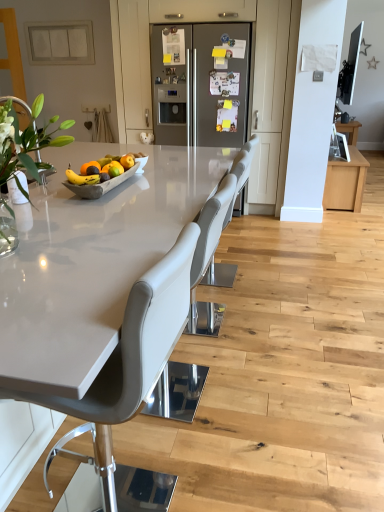
The image size is (384, 512). Describe the element at coordinates (81, 178) in the screenshot. I see `shiny metallic tray at center` at that location.

This screenshot has height=512, width=384. What do you see at coordinates (105, 182) in the screenshot? I see `wooden tray at center` at bounding box center [105, 182].

At what (x,y) coordinates should I click in order to perform the action: click on matte gray chair at center, which is the third chair in back-to-front order. Please return your answer as a coordinate pair (x, y). Looking at the image, I should click on (133, 355).

Is matte gray chair at center, which is the third chair in back-to-front order, spatially inside gray leather chair at center, arranged as the 1th chair when viewed from the back, or outside of it?

The correct answer is: outside.

Between matte gray chair at center, placed as the first chair when sorted from front to back, and gray leather chair at center, arranged as the 1th chair when viewed from the back, which one has larger size?

matte gray chair at center, placed as the first chair when sorted from front to back.

The width and height of the screenshot is (384, 512). I want to click on the 2nd chair behind when counting from the matte gray chair at center, placed as the first chair when sorted from front to back, so 239,177.

From the image's perspective, between matte gray chair at center, which is the third chair in back-to-front order, and gray leather chair at center, arranged as the 1th chair when viewed from the back, who is located below?

matte gray chair at center, which is the third chair in back-to-front order, appears lower in the image.

Where is `appliance on the left of gray leather chair at center, which is the 3th chair in front-to-back order`? This screenshot has width=384, height=512. appliance on the left of gray leather chair at center, which is the 3th chair in front-to-back order is located at coordinates (201, 84).

Does gray leather chair at center, arranged as the 1th chair when viewed from the back, turn towards satin steel refrigerator at center?

No, gray leather chair at center, arranged as the 1th chair when viewed from the back, is not turned towards satin steel refrigerator at center.

Is the depth of gray leather chair at center, arranged as the 1th chair when viewed from the back, less than that of satin steel refrigerator at center?

Yes, gray leather chair at center, arranged as the 1th chair when viewed from the back, is closer to the viewer.

From the image's perspective, is gray leather chair at center, arranged as the 1th chair when viewed from the back, on satin steel refrigerator at center?

No.

Is white glossy countertop at center facing away from satin silver refrigerator at center, which is the first cabinetry from right to left?

That's not correct — white glossy countertop at center is not looking away from satin silver refrigerator at center, which is the first cabinetry from right to left.

Considering the relative positions of white glossy countertop at center and satin silver refrigerator at center, positioned as the second cabinetry in left-to-right order, in the image provided, is white glossy countertop at center to the right of satin silver refrigerator at center, positioned as the second cabinetry in left-to-right order, from the viewer's perspective?

No, white glossy countertop at center is not to the right of satin silver refrigerator at center, positioned as the second cabinetry in left-to-right order.

Considering the sizes of objects white glossy countertop at center and satin silver refrigerator at center, which is the first cabinetry from right to left, in the image provided, who is bigger, white glossy countertop at center or satin silver refrigerator at center, which is the first cabinetry from right to left,?

With larger size is white glossy countertop at center.

From the picture: From a real-world perspective, who is located higher, gray leather chair at center, the 2th chair in the front-to-back sequence, or white matte switch plate at upper left, the first cabinetry in the left-to-right sequence?

From a 3D spatial view, white matte switch plate at upper left, the first cabinetry in the left-to-right sequence, is above.

Who is smaller, gray leather chair at center, the second chair from the back, or white matte switch plate at upper left, the first cabinetry in the left-to-right sequence?

white matte switch plate at upper left, the first cabinetry in the left-to-right sequence, is smaller.

Between gray leather chair at center, the 2th chair in the front-to-back sequence, and white matte switch plate at upper left, which ranks as the 2th cabinetry in right-to-left order, which one appears on the right side from the viewer's perspective?

From the viewer's perspective, gray leather chair at center, the 2th chair in the front-to-back sequence, appears more on the right side.

Is gray leather chair at center, the 2th chair in the front-to-back sequence, not close to white matte switch plate at upper left, which ranks as the 2th cabinetry in right-to-left order?

Absolutely, gray leather chair at center, the 2th chair in the front-to-back sequence, is distant from white matte switch plate at upper left, which ranks as the 2th cabinetry in right-to-left order.

Which is in front, point (167, 371) or point (225, 33)?

Positioned in front is point (167, 371).

Looking at their sizes, would you say gray leather chair at center, the 2th chair in the front-to-back sequence, is wider or thinner than satin steel refrigerator at center?

Clearly, gray leather chair at center, the 2th chair in the front-to-back sequence, has less width compared to satin steel refrigerator at center.

In the scene shown: From a real-world perspective, who is located lower, gray leather chair at center, the second chair from the back, or satin steel refrigerator at center?

In real-world perspective, gray leather chair at center, the second chair from the back, is lower.

Is wooden tray at center oriented away from gray leather chair at center, the second chair from the back?

No, gray leather chair at center, the second chair from the back, is not at the back of wooden tray at center.

Is wooden tray at center next to gray leather chair at center, the 2th chair in the front-to-back sequence?

No, wooden tray at center is not beside gray leather chair at center, the 2th chair in the front-to-back sequence.

Can you confirm if wooden tray at center is bigger than gray leather chair at center, the second chair from the back?

No.

Between wooden tray at center and gray leather chair at center, the 2th chair in the front-to-back sequence, which one has smaller width?

wooden tray at center.

Based on the photo, between wooden tray at center and orangesmoothfruit at center, which one is positioned behind?

orangesmoothfruit at center is behind.

From the image's perspective, is wooden tray at center on top of orangesmoothfruit at center?

No.

Can you tell me how much wooden tray at center and orangesmoothfruit at center differ in facing direction?

The angular difference between wooden tray at center and orangesmoothfruit at center is 1.91 degrees.

How much distance is there between wooden tray at center and orangesmoothfruit at center?

wooden tray at center and orangesmoothfruit at center are 5.09 inches apart from each other.

This screenshot has width=384, height=512. In order to click on chair that is the 2nd one above the gray leather chair at center, which is the 3th chair in front-to-back order (from a real-world perspective) in this screenshot , I will do `click(133, 355)`.

Where is `the 1st chair in front of the satin steel refrigerator at center`? the 1st chair in front of the satin steel refrigerator at center is located at coordinates (239, 177).

Estimate the real-world distances between objects in this image. Which object is further from wooden tray at center, white matte switch plate at upper left, which ranks as the 2th cabinetry in right-to-left order, or gray leather chair at center, arranged as the 1th chair when viewed from the back?

white matte switch plate at upper left, which ranks as the 2th cabinetry in right-to-left order, is positioned further to the anchor wooden tray at center.

Considering their positions, is white matte switch plate at upper left, the first cabinetry in the left-to-right sequence, positioned closer to gray leather chair at center, the 2th chair in the front-to-back sequence, than satin steel refrigerator at center?

Among the two, satin steel refrigerator at center is located nearer to gray leather chair at center, the 2th chair in the front-to-back sequence.

Considering their positions, is gray leather chair at center, the second chair from the back, positioned closer to white glossy countertop at center than orangesmoothfruit at center?

orangesmoothfruit at center is positioned closer to the anchor white glossy countertop at center.

Based on their spatial positions, is white matte switch plate at upper left, which ranks as the 2th cabinetry in right-to-left order, or shiny metallic tray at center closer to matte gray chair at center, which is the third chair in back-to-front order?

shiny metallic tray at center.

When comparing their distances from wooden tray at center, does gray leather chair at center, arranged as the 1th chair when viewed from the back, or satin silver refrigerator at center, positioned as the second cabinetry in left-to-right order, seem closer?

Based on the image, gray leather chair at center, arranged as the 1th chair when viewed from the back, appears to be nearer to wooden tray at center.

When comparing their distances from gray leather chair at center, arranged as the 1th chair when viewed from the back, does wooden tray at center or gray leather chair at center, the 2th chair in the front-to-back sequence, seem further?

Based on the image, gray leather chair at center, the 2th chair in the front-to-back sequence, appears to be further to gray leather chair at center, arranged as the 1th chair when viewed from the back.

Looking at the image, which one is located closer to shiny metallic tray at center, white glossy countertop at center or gray leather chair at center, the 2th chair in the front-to-back sequence?

white glossy countertop at center lies closer to shiny metallic tray at center than the other object.

When comparing their distances from shiny metallic tray at center, does matte gray chair at center, which is the third chair in back-to-front order, or gray leather chair at center, the 2th chair in the front-to-back sequence, seem closer?

matte gray chair at center, which is the third chair in back-to-front order, is closer to shiny metallic tray at center.

Find the location of `fruit dish between matte gray chair at center, which is the third chair in back-to-front order, and satin silver refrigerator at center, positioned as the second cabinetry in left-to-right order, from front to back`. fruit dish between matte gray chair at center, which is the third chair in back-to-front order, and satin silver refrigerator at center, positioned as the second cabinetry in left-to-right order, from front to back is located at coordinates (105, 182).

The width and height of the screenshot is (384, 512). What are the coordinates of `orange between wooden tray at center and gray leather chair at center, which is the 3th chair in front-to-back order, in the front-back direction` in the screenshot? It's located at (117, 166).

The width and height of the screenshot is (384, 512). What are the coordinates of `fruit dish located between white glossy countertop at center and white matte switch plate at upper left, which ranks as the 2th cabinetry in right-to-left order, in the depth direction` in the screenshot? It's located at (105, 182).

At what (x,y) coordinates should I click in order to perform the action: click on fruit between matte gray chair at center, placed as the first chair when sorted from front to back, and gray leather chair at center, arranged as the 1th chair when viewed from the back, in the front-back direction. Please return your answer as a coordinate pair (x, y). Looking at the image, I should click on (81, 178).